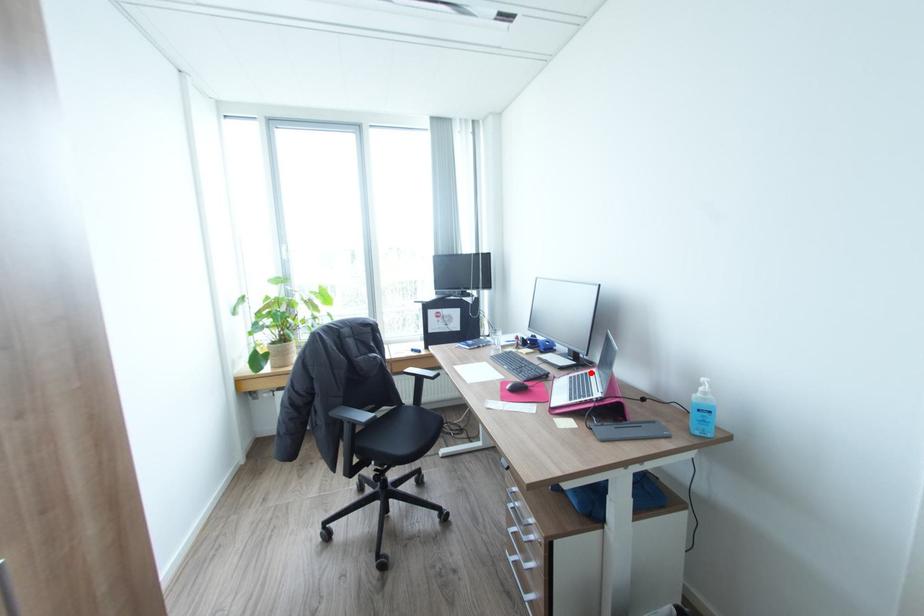
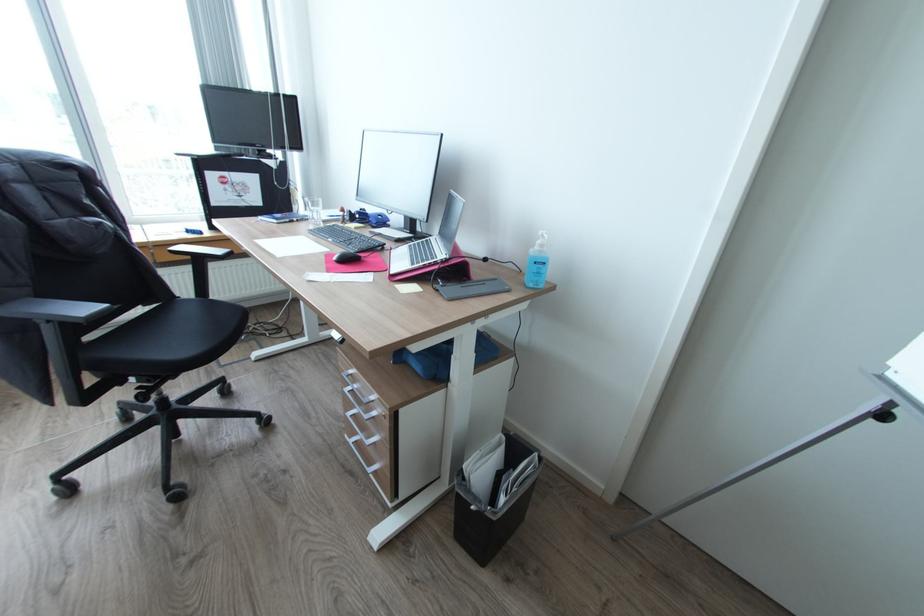
Where in the second image is the point corresponding to the highlighted location from the first image?

(432, 238)